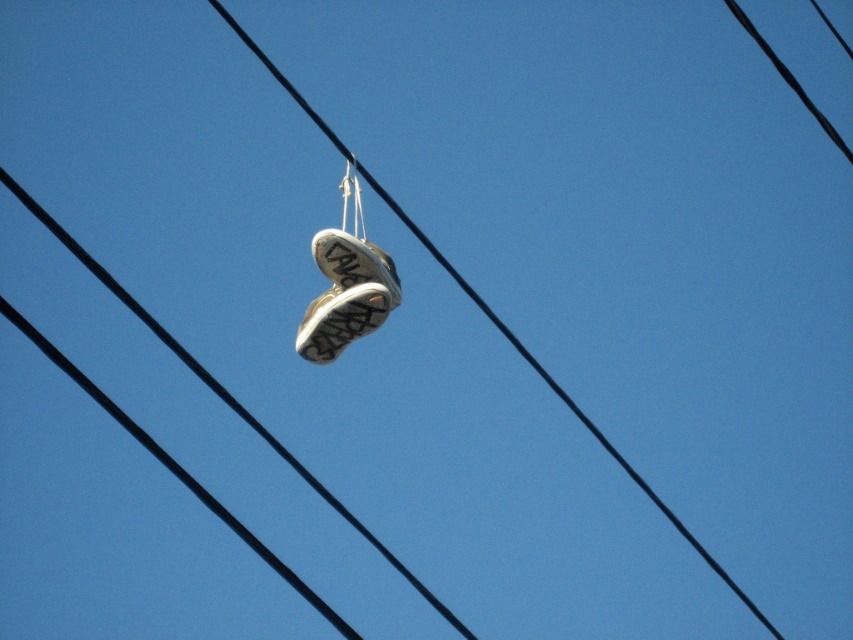
Question: Does black rubber shoe at center come in front of white fabric shoe at center?

Choices:
 (A) no
 (B) yes

Answer: (A)

Question: Which of the following is the closest to the observer?

Choices:
 (A) white leather sneakers at center
 (B) white fabric shoe at center
 (C) black rubber shoe at center

Answer: (B)

Question: Does black rubber shoe at center come behind white fabric shoe at center?

Choices:
 (A) no
 (B) yes

Answer: (B)

Question: Can you confirm if black rubber shoe at center is positioned to the right of white fabric shoe at center?

Choices:
 (A) yes
 (B) no

Answer: (A)

Question: Which object appears farthest from the camera in this image?

Choices:
 (A) white leather sneakers at center
 (B) black rubber shoe at center

Answer: (A)

Question: Considering the real-world distances, which object is farthest from the white leather sneakers at center?

Choices:
 (A) black rubber shoe at center
 (B) white fabric shoe at center

Answer: (A)